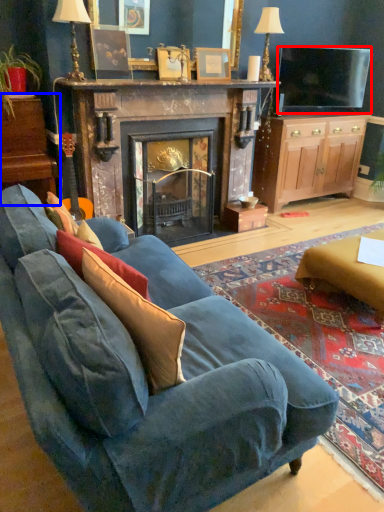
Question: Which point is further to the camera, television (highlighted by a red box) or dresser (highlighted by a blue box)?

Choices:
 (A) television
 (B) dresser

Answer: (A)